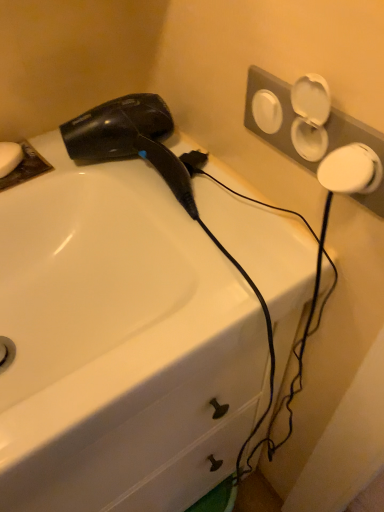
Question: Looking at the image, does black glossy hair dryer at upper left seem bigger or smaller compared to white matte soap at upper left?

Choices:
 (A) small
 (B) big

Answer: (B)

Question: From the image's perspective, is black glossy hair dryer at upper left positioned above or below white matte soap at upper left?

Choices:
 (A) below
 (B) above

Answer: (A)

Question: Estimate the real-world distances between objects in this image. Which object is closer to the black glossy hair dryer at upper left?

Choices:
 (A) white matte soap at upper left
 (B) white glossy sink at upper left

Answer: (B)

Question: Which object is positioned closest to the white glossy sink at upper left?

Choices:
 (A) white matte soap at upper left
 (B) black glossy hair dryer at upper left

Answer: (B)